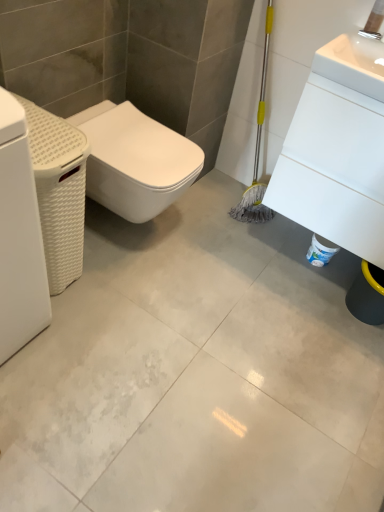
Question: Considering the relative sizes of white matte washing machine at left and white woven basket at left, placed as the 2th porcelain when sorted from right to left, in the image provided, is white matte washing machine at left wider than white woven basket at left, placed as the 2th porcelain when sorted from right to left,?

Choices:
 (A) yes
 (B) no

Answer: (B)

Question: Can you confirm if white matte washing machine at left is smaller than white woven basket at left, the first porcelain viewed from the left?

Choices:
 (A) no
 (B) yes

Answer: (A)

Question: From the image's perspective, would you say white matte washing machine at left is positioned over white woven basket at left, the first porcelain viewed from the left?

Choices:
 (A) no
 (B) yes

Answer: (A)

Question: From the image's perspective, does white matte washing machine at left appear lower than white woven basket at left, placed as the 2th porcelain when sorted from right to left?

Choices:
 (A) no
 (B) yes

Answer: (B)

Question: Is the depth of white matte washing machine at left greater than that of white woven basket at left, the first porcelain viewed from the left?

Choices:
 (A) no
 (B) yes

Answer: (A)

Question: Looking at their shapes, would you say white matte bidet at left is wider or thinner than white matte washing machine at left?

Choices:
 (A) wide
 (B) thin

Answer: (A)

Question: From a real-world perspective, is white matte bidet at left positioned above or below white matte washing machine at left?

Choices:
 (A) below
 (B) above

Answer: (A)

Question: Is point (180, 146) positioned closer to the camera than point (31, 230)?

Choices:
 (A) farther
 (B) closer

Answer: (A)

Question: From the image's perspective, is white matte bidet at left above or below white matte washing machine at left?

Choices:
 (A) above
 (B) below

Answer: (A)

Question: Is white glossy concrete at center wider or thinner than white woven basket at left, the first porcelain viewed from the left?

Choices:
 (A) thin
 (B) wide

Answer: (B)

Question: From a real-world perspective, relative to white woven basket at left, the first porcelain viewed from the left, is white glossy concrete at center vertically above or below?

Choices:
 (A) below
 (B) above

Answer: (A)

Question: Would you say white glossy concrete at center is inside or outside white woven basket at left, placed as the 2th porcelain when sorted from right to left?

Choices:
 (A) inside
 (B) outside

Answer: (B)

Question: Visually, is white glossy concrete at center positioned to the left or to the right of white woven basket at left, the first porcelain viewed from the left?

Choices:
 (A) left
 (B) right

Answer: (B)

Question: Considering the positions of white woven basket at left, the first porcelain viewed from the left, and white matte bidet at left in the image, is white woven basket at left, the first porcelain viewed from the left, taller or shorter than white matte bidet at left?

Choices:
 (A) tall
 (B) short

Answer: (A)

Question: Is white woven basket at left, the first porcelain viewed from the left, wider or thinner than white matte bidet at left?

Choices:
 (A) thin
 (B) wide

Answer: (A)